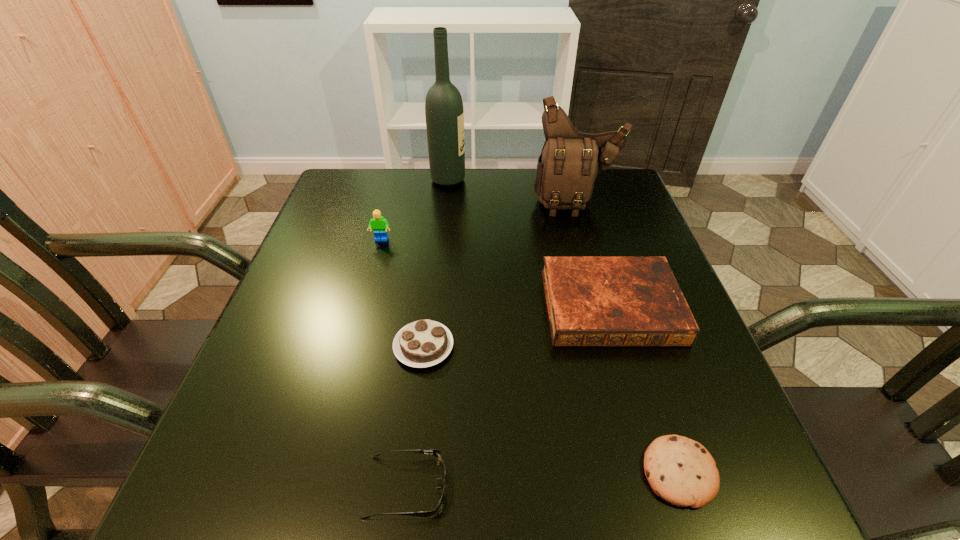
Select which object appears as the third closest to the sunglasses. Please provide its 2D coordinates. Your answer should be formatted as a tuple, i.e. [(x, y)], where the tuple contains the x and y coordinates of a point satisfying the conditions above.

[(681, 471)]

You are a GUI agent. You are given a task and a screenshot of the screen. Output one action in this format:
    pyautogui.click(x=<x>, y=<y>)
    Task: Click on the object that stands as the fifth closest to the second tallest object
    The width and height of the screenshot is (960, 540).
    Given the screenshot: What is the action you would take?
    pyautogui.click(x=681, y=471)

The image size is (960, 540). In order to click on vacant region that satisfies the following two spatial constraints: 1. on the labeled side of the wine bottle; 2. on the left side of the cookie in this screenshot , I will do `click(419, 472)`.

The image size is (960, 540). I want to click on vacant area in the image that satisfies the following two spatial constraints: 1. on the labeled side of the tallest object; 2. on the left side of the cookie, so click(419, 472).

Locate an element on the screen. This screenshot has width=960, height=540. free point that satisfies the following two spatial constraints: 1. on the front side of the chocolate cake; 2. on the front-facing side of the sunglasses is located at coordinates (407, 487).

Identify the location of vacant space that satisfies the following two spatial constraints: 1. on the face of the cookie; 2. on the left side of the fifth nearest object. The height and width of the screenshot is (540, 960). (321, 472).

Locate an element on the screen. The width and height of the screenshot is (960, 540). free space that satisfies the following two spatial constraints: 1. on the labeled side of the tallest object; 2. on the front side of the fifth tallest object is located at coordinates (431, 346).